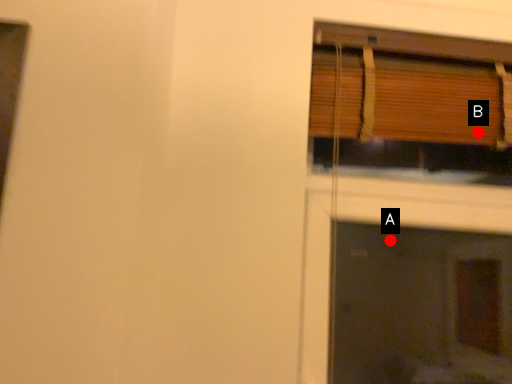
Question: Two points are circled on the image, labeled by A and B beside each circle. Which point appears farthest from the camera in this image?

Choices:
 (A) A is further
 (B) B is further

Answer: (A)